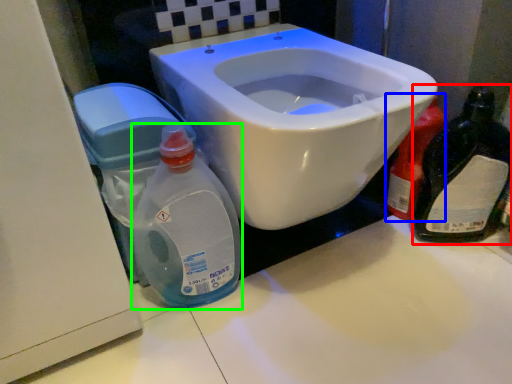
Question: Considering the real-world distances, which object is closest to bottle (highlighted by a red box)? cleaning product (highlighted by a blue box) or baby bottle (highlighted by a green box).

Choices:
 (A) cleaning product
 (B) baby bottle

Answer: (A)